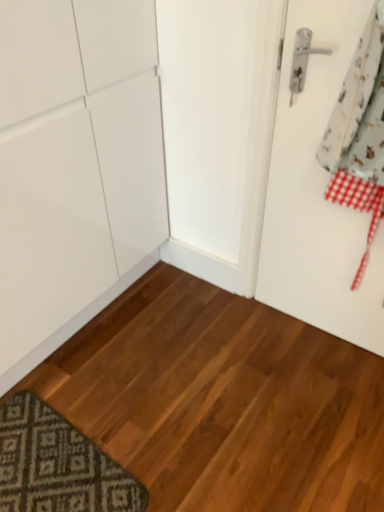
At what (x,y) coordinates should I click in order to perform the action: click on white glossy door at right. Please return your answer as a coordinate pair (x, y). This screenshot has width=384, height=512. Looking at the image, I should click on (318, 193).

The height and width of the screenshot is (512, 384). What do you see at coordinates (318, 193) in the screenshot? I see `white glossy door at right` at bounding box center [318, 193].

This screenshot has width=384, height=512. Find the location of `white glossy door at right`. white glossy door at right is located at coordinates (318, 193).